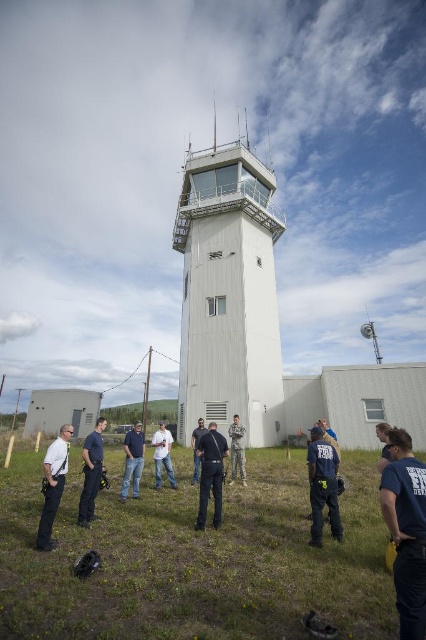
Which is in front, point (215, 372) or point (158, 460)?

Point (158, 460) is more forward.

Image resolution: width=426 pixels, height=640 pixels. Find the location of `white smooth control tower at center`. white smooth control tower at center is located at coordinates (229, 292).

Is white smooth control tower at center to the right of blue uniform at lower left from the viewer's perspective?

Yes, white smooth control tower at center is to the right of blue uniform at lower left.

Is point (259, 435) closer to viewer compared to point (83, 518)?

No, it is behind (83, 518).

Is point (250, 337) positioned behind point (92, 435)?

Yes, point (250, 337) is behind point (92, 435).

The image size is (426, 640). I want to click on white smooth control tower at center, so click(x=229, y=292).

Is white cotton shirt at center shorter than black leather jacket at center?

No.

This screenshot has width=426, height=640. Describe the element at coordinates (163, 456) in the screenshot. I see `white cotton shirt at center` at that location.

Locate an element on the screen. The height and width of the screenshot is (640, 426). white cotton shirt at center is located at coordinates (163, 456).